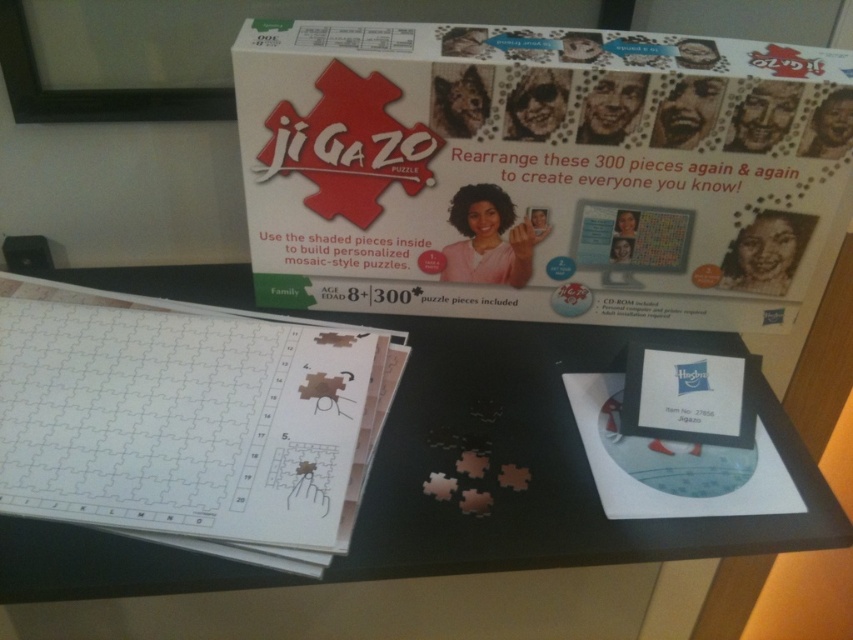
Describe the element at coordinates (538, 170) in the screenshot. I see `white cardboard poster at upper center` at that location.

Which of these two, white cardboard poster at upper center or white paper puzzle at center, stands taller?

white cardboard poster at upper center is taller.

The width and height of the screenshot is (853, 640). What do you see at coordinates (538, 170) in the screenshot?
I see `white cardboard poster at upper center` at bounding box center [538, 170].

Locate an element on the screen. white cardboard poster at upper center is located at coordinates (538, 170).

Is black matte table at center below white paper puzzle at center?

Yes, black matte table at center is below white paper puzzle at center.

Can you confirm if black matte table at center is positioned above white paper puzzle at center?

Incorrect, black matte table at center is not positioned above white paper puzzle at center.

Who is more distant from viewer, (811, 531) or (27, 284)?

The point (27, 284) is more distant.

Identify the location of black matte table at center. The width and height of the screenshot is (853, 640). tap(535, 461).

Is white cardboard poster at upper center shorter than black matte table at center?

In fact, white cardboard poster at upper center may be taller than black matte table at center.

Which is more to the right, white cardboard poster at upper center or black matte table at center?

white cardboard poster at upper center is more to the right.

Between point (544, 195) and point (833, 541), which one is positioned in front?

Point (833, 541) is more forward.

Where is `white cardboard poster at upper center`? The height and width of the screenshot is (640, 853). white cardboard poster at upper center is located at coordinates [x=538, y=170].